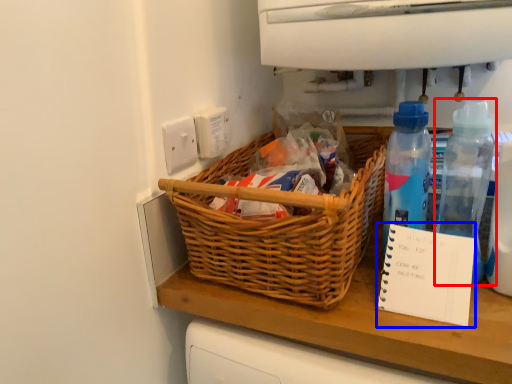
Question: Which object appears farthest to the camera in this image, bottle (highlighted by a red box) or notebook (highlighted by a blue box)?

Choices:
 (A) bottle
 (B) notebook

Answer: (A)